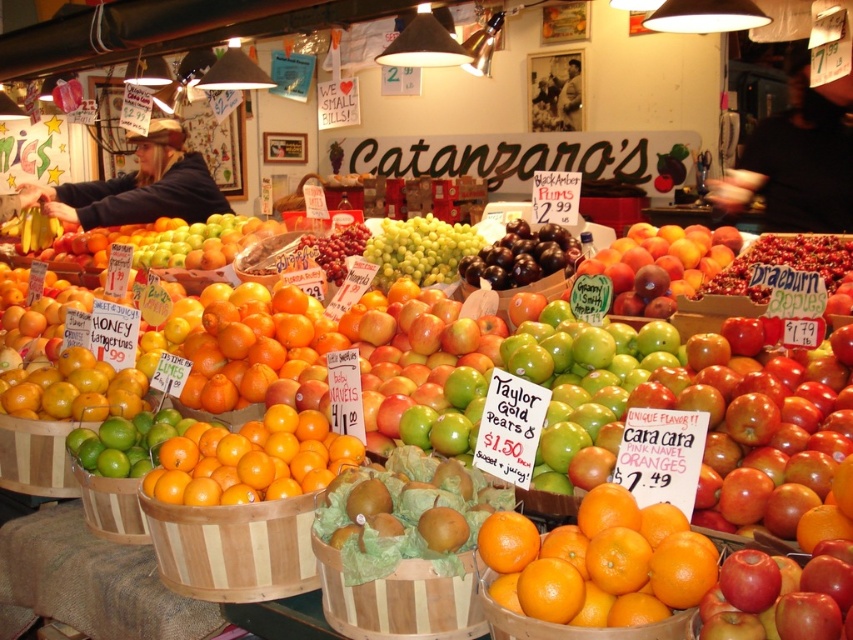
Is orangesmoothorange at right taller than orangesmoothorange at center?

Yes.

Who is positioned more to the right, orangesmoothorange at right or orangesmoothorange at center?

orangesmoothorange at right is more to the right.

Is point (527, 557) closer to viewer compared to point (579, 586)?

No, it is not.

Find the location of `orangesmoothorange at right`. orangesmoothorange at right is located at coordinates (599, 563).

Does shiny orange oranges at center have a larger size compared to green matte grapes at center?

Incorrect, shiny orange oranges at center is not larger than green matte grapes at center.

Does shiny orange oranges at center have a lesser height compared to green matte grapes at center?

Correct, shiny orange oranges at center is not as tall as green matte grapes at center.

This screenshot has width=853, height=640. What do you see at coordinates (250, 460) in the screenshot?
I see `shiny orange oranges at center` at bounding box center [250, 460].

The height and width of the screenshot is (640, 853). Identify the location of shiny orange oranges at center. (250, 460).

Does red matte apple at lower right appear under shiny dark purple grapes at center?

Yes.

Looking at this image, which is more to the right, red matte apple at lower right or shiny dark purple grapes at center?

red matte apple at lower right is more to the right.

At what (x,y) coordinates should I click in order to perform the action: click on red matte apple at lower right. Please return your answer as a coordinate pair (x, y). Image resolution: width=853 pixels, height=640 pixels. Looking at the image, I should click on 778,598.

Identify the location of red matte apple at lower right. (778, 598).